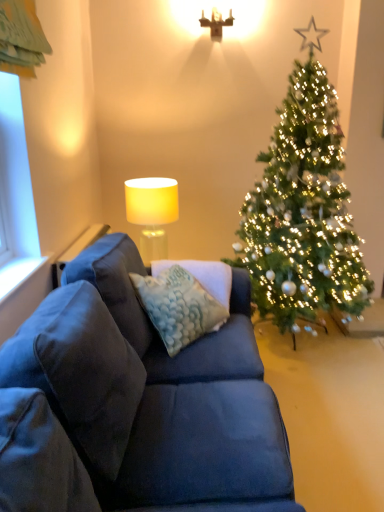
Where is `vacant area situated below green textured christmas tree at right (from a real-world perspective)`? vacant area situated below green textured christmas tree at right (from a real-world perspective) is located at coordinates (306, 350).